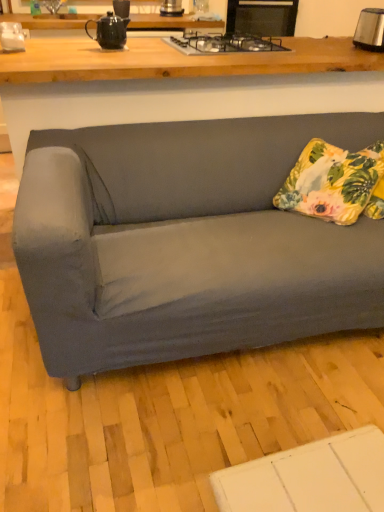
The height and width of the screenshot is (512, 384). I want to click on free space between matte black teapot at upper center and white glossy coffee maker at upper left, which appears as the 2th appliance when viewed from the right, so tap(72, 47).